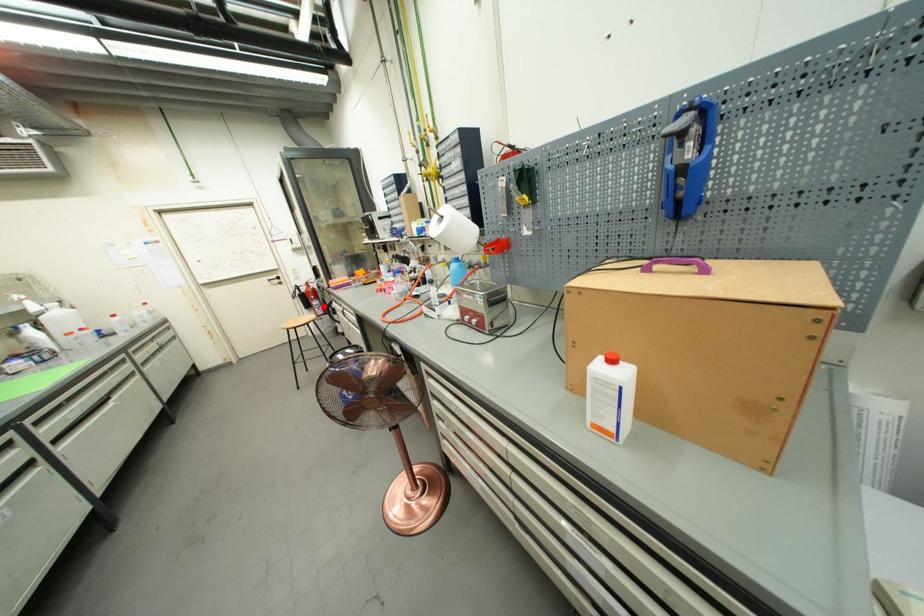
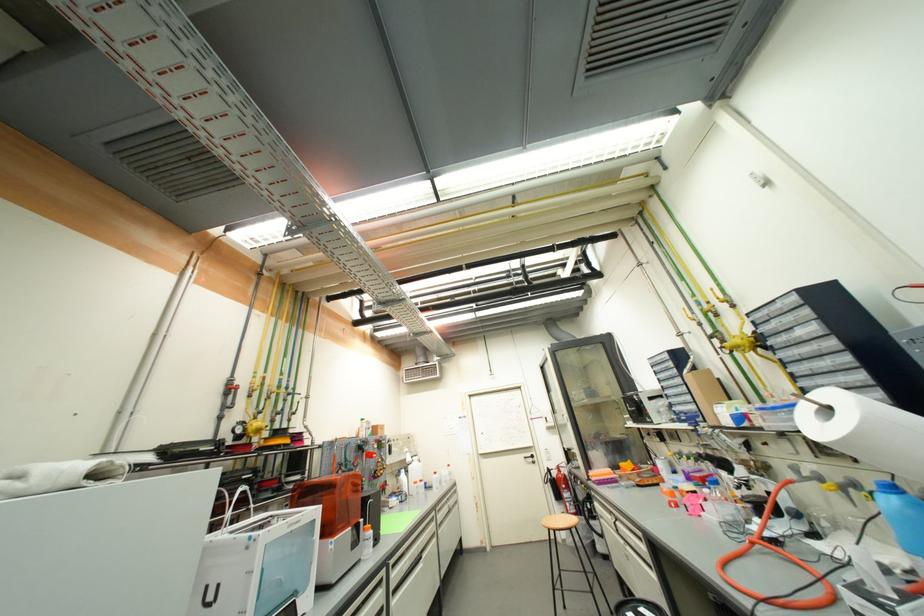
The point at the highlighted location is marked in the first image. Where is the corresponding point in the second image?

(575, 500)